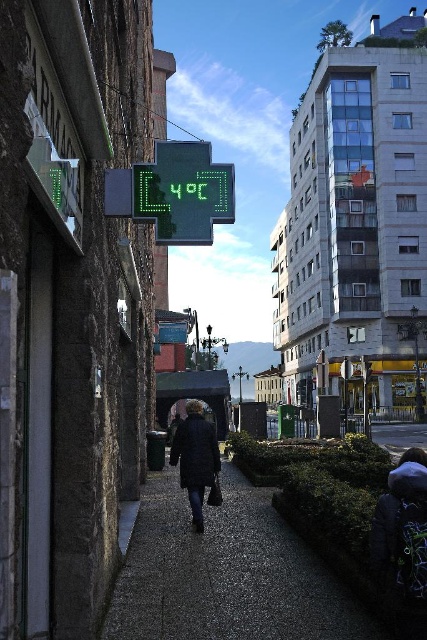
Question: Which point is farther to the camera?

Choices:
 (A) green plastic thermometer at upper center
 (B) dark blue coat at center
 (C) dark gray jacket at lower right
 (D) dark gray gravel at center

Answer: (B)

Question: Is dark gray jacket at lower right positioned before dark blue coat at center?

Choices:
 (A) no
 (B) yes

Answer: (B)

Question: Among these points, which one is nearest to the camera?

Choices:
 (A) (211, 576)
 (B) (198, 512)

Answer: (A)

Question: Which object appears farthest from the camera in this image?

Choices:
 (A) dark gray jacket at lower right
 (B) green plastic thermometer at upper center

Answer: (B)

Question: Is the position of green plastic thermometer at upper center more distant than that of dark gray jacket at lower right?

Choices:
 (A) no
 (B) yes

Answer: (B)

Question: Can you confirm if green plastic thermometer at upper center is thinner than dark gray jacket at lower right?

Choices:
 (A) no
 (B) yes

Answer: (A)